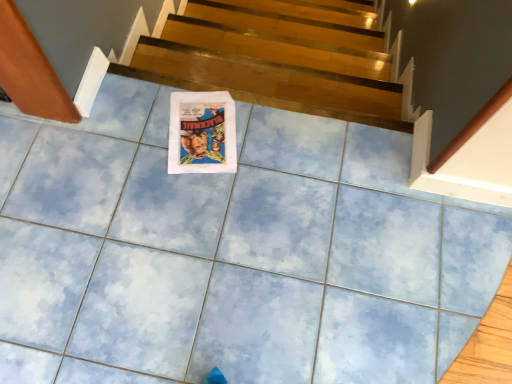
Where is `free space above matte paper poster at center (from a real-world perspective)`? This screenshot has height=384, width=512. free space above matte paper poster at center (from a real-world perspective) is located at coordinates (202, 130).